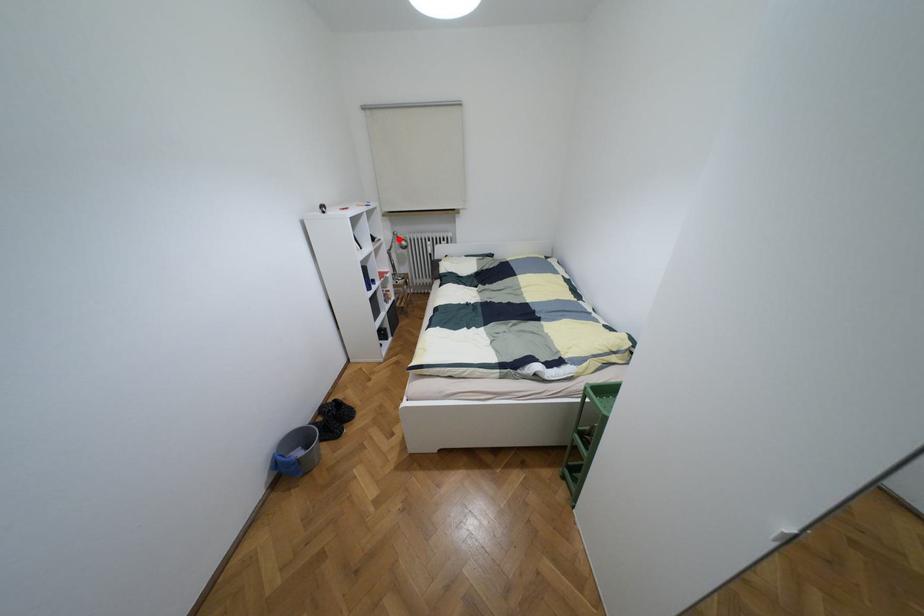
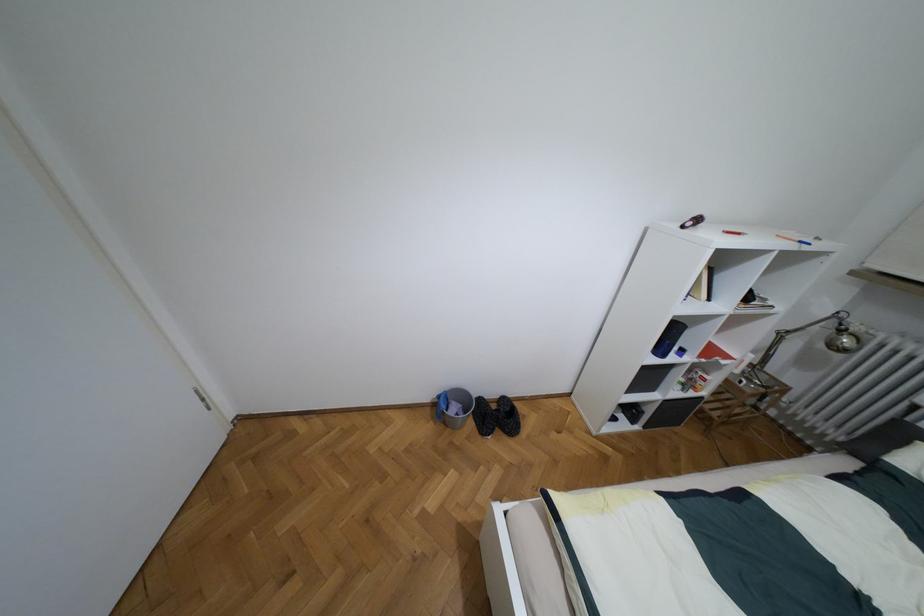
Question: I am providing you with two images of the same scene from different viewpoints. Image1 has a red point marked. In image2, the corresponding 3D location appears at what relative position? Reply with the corresponding letter.

Choices:
 (A) Closer
 (B) Farther

Answer: (B)